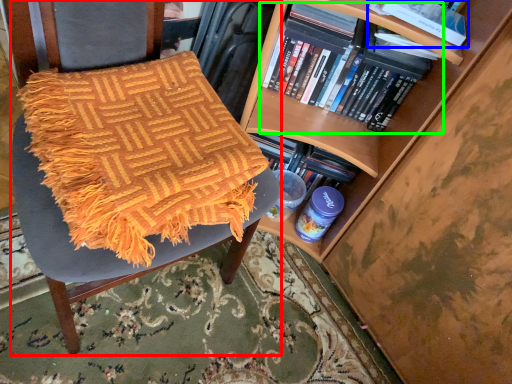
Question: Which object is positioned closest to chair (highlighted by a red box)? Select from book (highlighted by a blue box) and book (highlighted by a green box).

Choices:
 (A) book
 (B) book

Answer: (B)